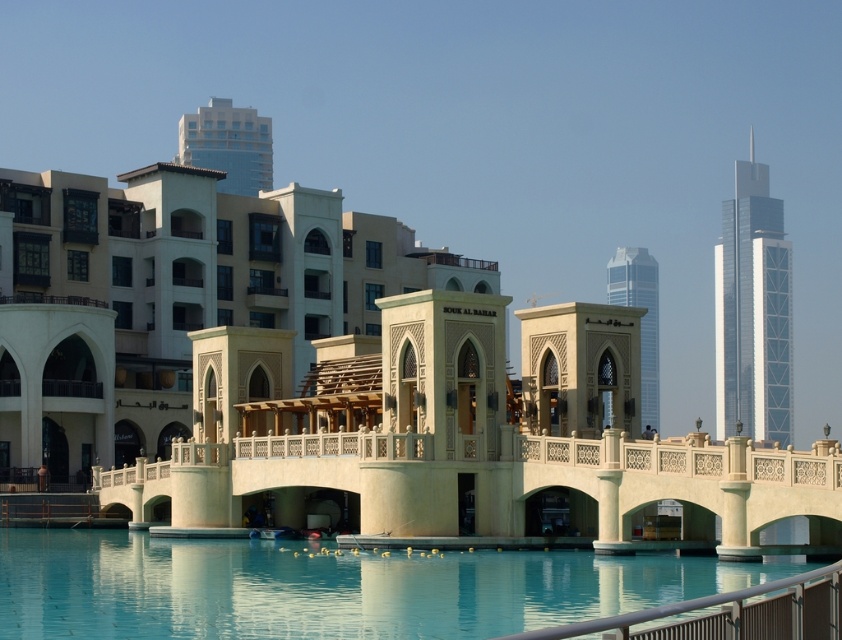
Who is more distant from viewer, (6, 356) or (759, 236)?

Point (759, 236)

Describe the element at coordinates (173, 300) in the screenshot. I see `beige stone souk al bahar at center` at that location.

Locate an element on the screen. beige stone souk al bahar at center is located at coordinates (173, 300).

From the picture: Is shiny silver skyscraper at right smaller than silver glass skyscraper at upper right?

Indeed, shiny silver skyscraper at right has a smaller size compared to silver glass skyscraper at upper right.

Does shiny silver skyscraper at right appear under silver glass skyscraper at upper right?

No.

Locate an element on the screen. The image size is (842, 640). shiny silver skyscraper at right is located at coordinates (753, 310).

Does smooth concrete pool at center have a greater width compared to silver glass skyscraper at upper right?

Indeed, smooth concrete pool at center has a greater width compared to silver glass skyscraper at upper right.

Does smooth concrete pool at center appear over silver glass skyscraper at upper right?

No, smooth concrete pool at center is not above silver glass skyscraper at upper right.

Is point (86, 554) positioned in front of point (638, 273)?

Yes.

The image size is (842, 640). Identify the location of smooth concrete pool at center. (324, 588).